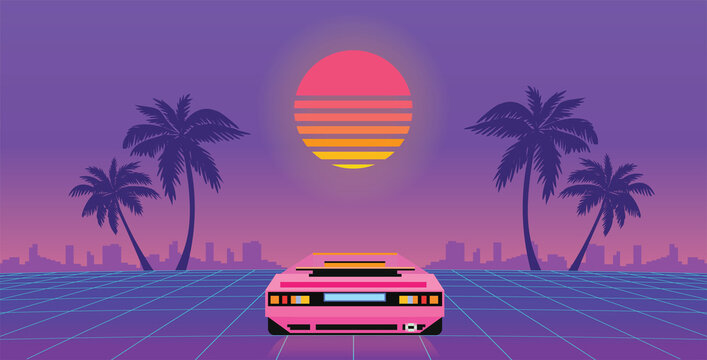
Identify the location of window. The width and height of the screenshot is (707, 360). (353, 271).